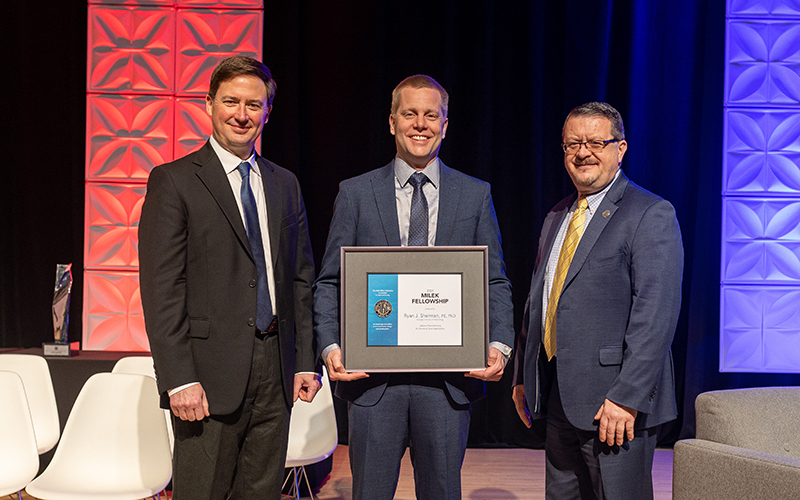
At what (x,y) coordinates should I click in order to perform the action: click on red column. Please return your answer as a coordinate pair (x, y). The image size is (800, 500). Looking at the image, I should click on (122, 140), (118, 238), (190, 35).